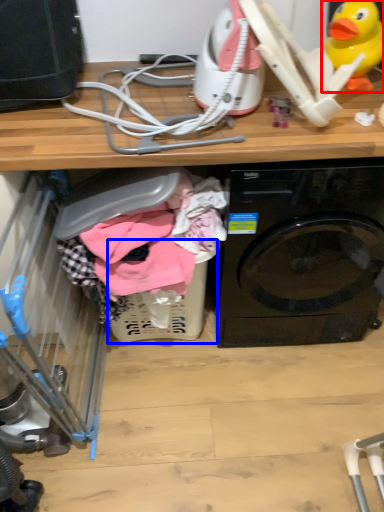
Question: Among these objects, which one is nearest to the camera, toy (highlighted by a red box) or basket (highlighted by a blue box)?

Choices:
 (A) toy
 (B) basket

Answer: (A)